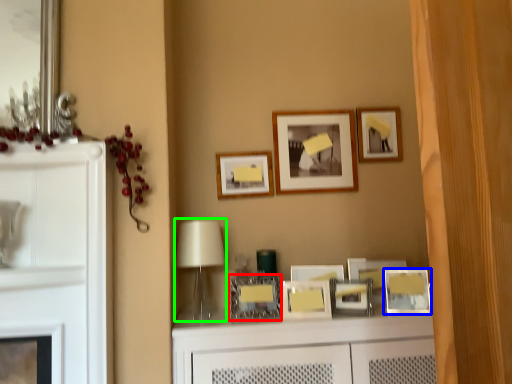
Question: Which object is positioned farthest from picture frame (highlighted by a red box)? Select from picture frame (highlighted by a blue box) and table lamp (highlighted by a green box).

Choices:
 (A) picture frame
 (B) table lamp

Answer: (A)